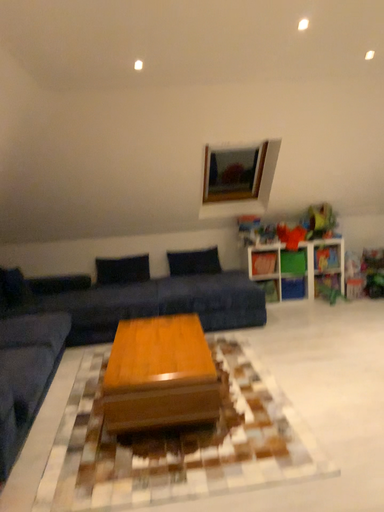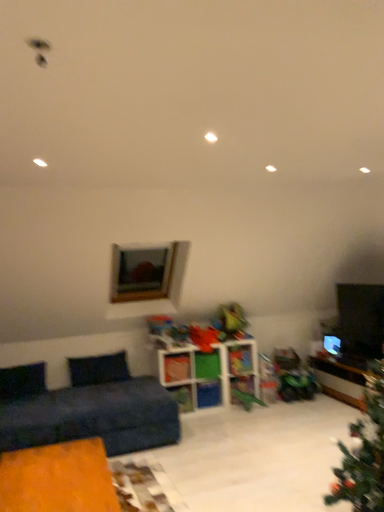
Question: Which way did the camera rotate in the video?

Choices:
 (A) rotated right
 (B) rotated left

Answer: (A)